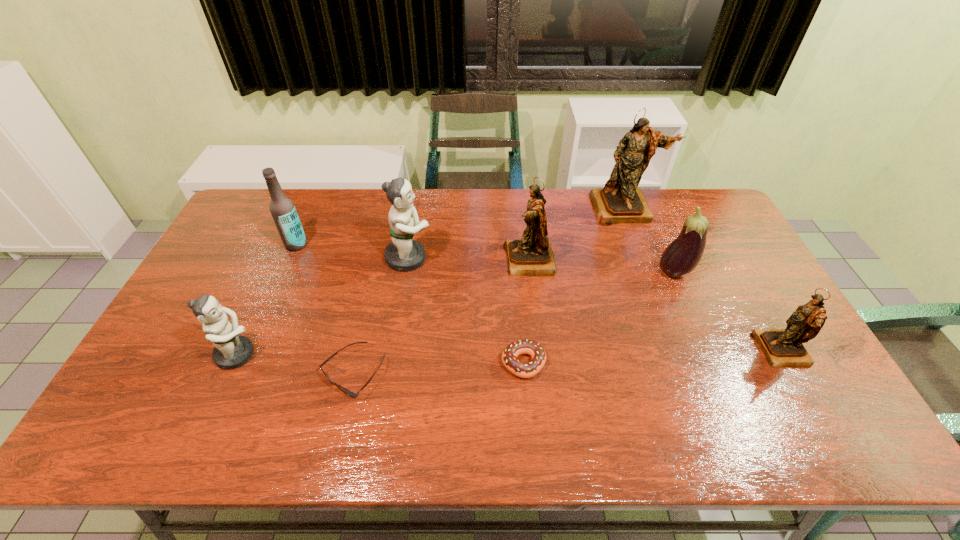
This screenshot has width=960, height=540. Identify the location of vacant region located on the side of the beer bottle with the label. (269, 309).

This screenshot has height=540, width=960. Identify the location of free space located on the front of the eggplant. (719, 376).

Find the location of a particular element. blank space located 0.330m on the front-facing side of the smallest gold figurine is located at coordinates (635, 350).

Locate an element on the screen. The width and height of the screenshot is (960, 540). free spot located 0.310m on the front-facing side of the smallest gold figurine is located at coordinates (642, 350).

I want to click on free point located on the front-facing side of the smallest gold figurine, so click(729, 350).

Where is `vacant space situated 0.140m on the front-facing side of the left green figurine`? vacant space situated 0.140m on the front-facing side of the left green figurine is located at coordinates (313, 354).

The image size is (960, 540). In order to click on free space located on the back of the doughnut in this screenshot , I will do `click(516, 263)`.

Locate an element on the screen. The width and height of the screenshot is (960, 540). object that is at the far edge is located at coordinates (621, 200).

This screenshot has width=960, height=540. I want to click on object that is positioned at the right edge, so click(782, 347).

Find the location of a particular element. free spot at the far edge of the desktop is located at coordinates (304, 217).